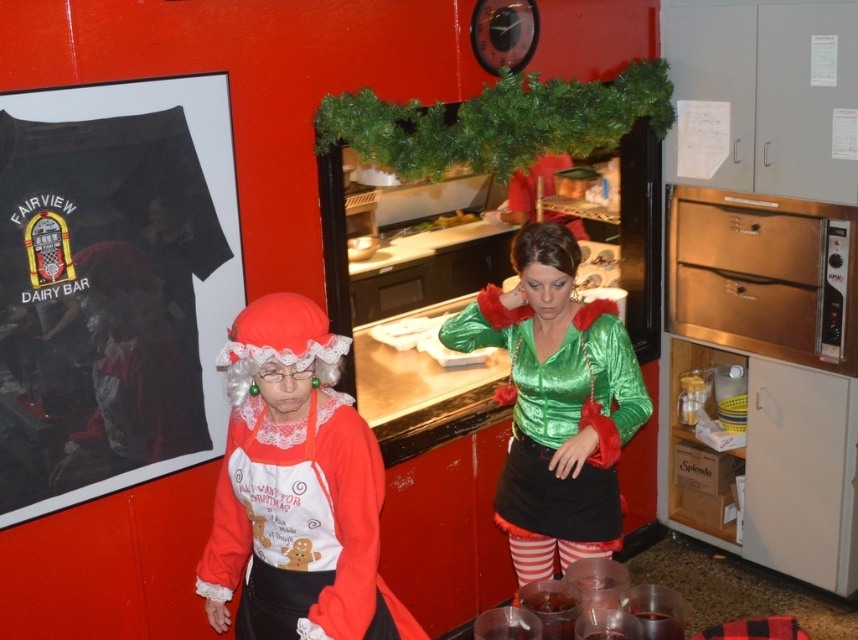
Measure the distance from green shiny blouse at center to translucent glass cup at lower center.

green shiny blouse at center is 26.22 inches from translucent glass cup at lower center.

Which is behind, point (601, 339) or point (554, 595)?

Point (601, 339)

The height and width of the screenshot is (640, 858). Identify the location of green shiny blouse at center. (556, 403).

Can you confirm if matte white apron at center is smaller than translucent glass cup at lower center?

No, matte white apron at center is not smaller than translucent glass cup at lower center.

Between matte white apron at center and translucent glass cup at lower center, which one has more height?

matte white apron at center is taller.

Identify the location of matte white apron at center. (295, 488).

Identify the location of matte white apron at center. (295, 488).

What do you see at coordinates (295, 488) in the screenshot?
I see `matte white apron at center` at bounding box center [295, 488].

Looking at this image, which is below, matte white apron at center or green shiny blouse at center?

Positioned lower is matte white apron at center.

Locate an element on the screen. The image size is (858, 640). matte white apron at center is located at coordinates (295, 488).